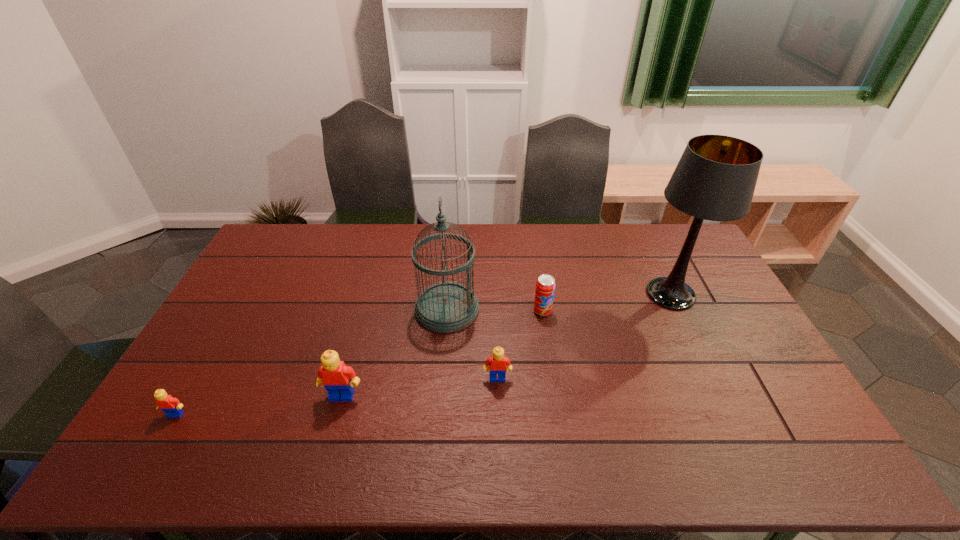
You are a GUI agent. You are given a task and a screenshot of the screen. Output one action in this format:
    pyautogui.click(x=<x>, y=<y>)
    Task: Click on the second object from right to left
    The image size is (960, 540).
    Given the screenshot: What is the action you would take?
    pyautogui.click(x=545, y=286)

Locate an element on the screen. The height and width of the screenshot is (540, 960). vacant space located on the face of the second farthest Lego is located at coordinates (334, 426).

Locate an element on the screen. free space located on the face of the second tallest Lego is located at coordinates (498, 405).

Where is `free location located on the back of the tallest object`? This screenshot has height=540, width=960. free location located on the back of the tallest object is located at coordinates (642, 234).

Locate an element on the screen. vacant space situated on the front-facing side of the third object from left to right is located at coordinates (547, 309).

Identify the location of vacant space located 0.390m on the left of the second object from right to left. (412, 311).

Locate an element on the screen. object that is at the left edge is located at coordinates (171, 406).

Identify the location of object that is at the right edge. The width and height of the screenshot is (960, 540). pos(715,179).

You are a GUI agent. You are given a task and a screenshot of the screen. Output one action in this format:
    pyautogui.click(x=<x>, y=<y>)
    Task: Click on the object present at the near left corner
    
    Given the screenshot: What is the action you would take?
    pyautogui.click(x=171, y=406)

The width and height of the screenshot is (960, 540). Find the location of `free spot at the far edge of the desktop`. free spot at the far edge of the desktop is located at coordinates (516, 224).